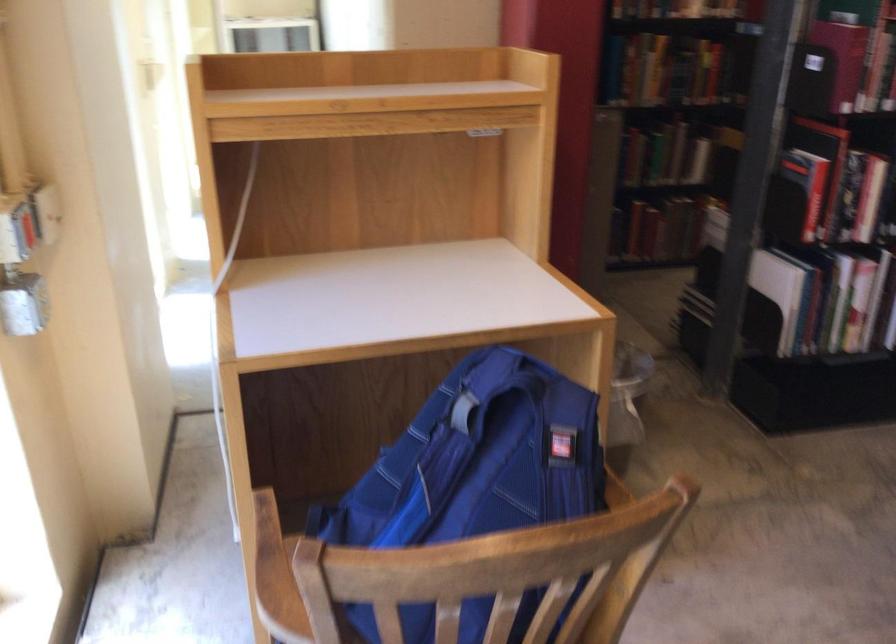
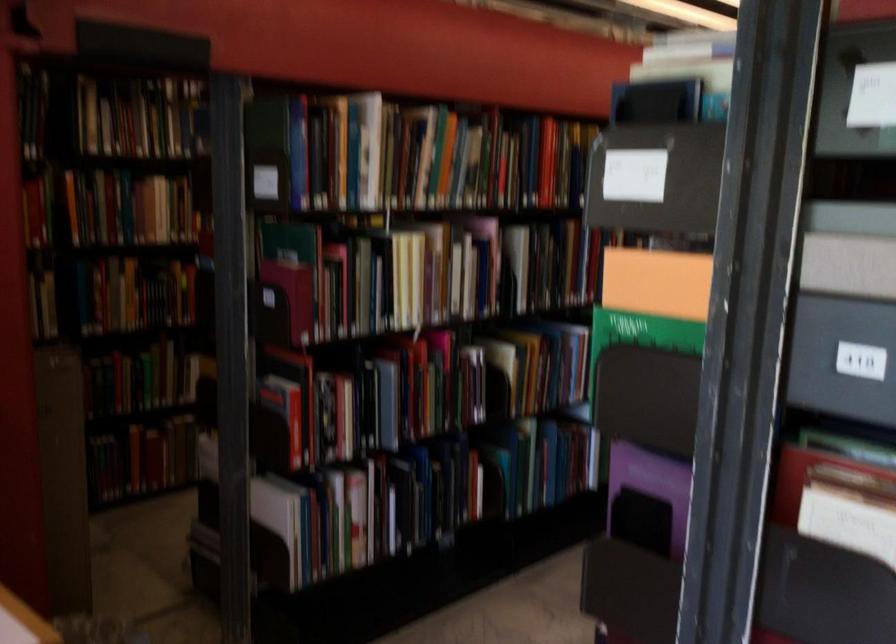
Question: Based on the continuous images, in which direction is the camera rotating? Reply with the corresponding letter.

Choices:
 (A) Left
 (B) Right
 (C) Up
 (D) Down

Answer: (B)